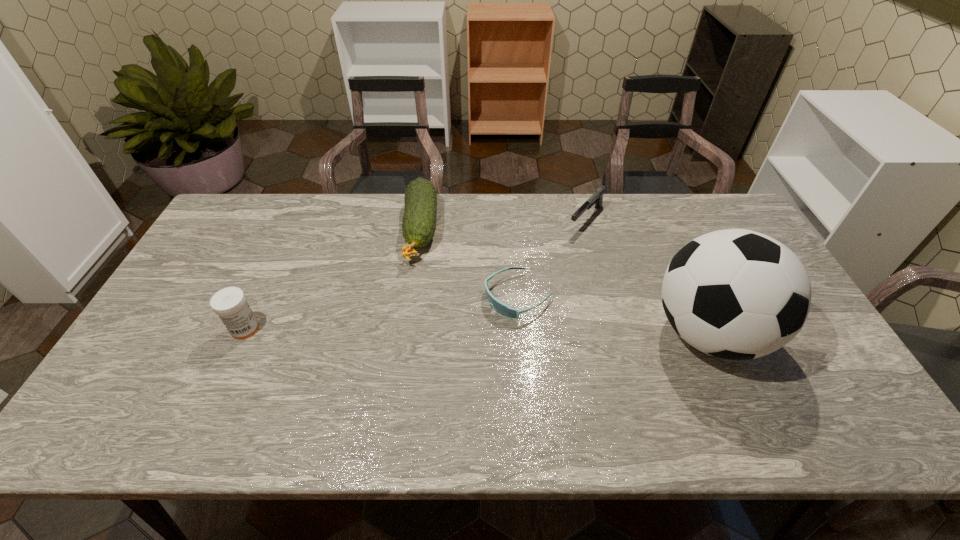
This screenshot has width=960, height=540. What are the coordinates of `free spot located 0.210m on the back of the rightmost object` in the screenshot? It's located at (667, 242).

This screenshot has height=540, width=960. I want to click on vacant space located at the muzzle end of the fourth object from left to right, so click(514, 301).

Locate an element on the screen. vacant point located at the muzzle end of the fourth object from left to right is located at coordinates (565, 244).

Where is `vacant space situated 0.210m at the muzzle end of the fourth object from left to right`? The height and width of the screenshot is (540, 960). vacant space situated 0.210m at the muzzle end of the fourth object from left to right is located at coordinates (543, 269).

Image resolution: width=960 pixels, height=540 pixels. I want to click on vacant area situated on the front-facing side of the third object from right to left, so click(398, 363).

This screenshot has width=960, height=540. Find the location of `blank area located on the front-facing side of the third object from right to left`. blank area located on the front-facing side of the third object from right to left is located at coordinates (366, 382).

What are the coordinates of `vacant space located on the front-facing side of the third object from right to left` in the screenshot? It's located at (398, 363).

This screenshot has width=960, height=540. I want to click on free space located 0.130m at the blossom end of the second object from left to right, so click(x=411, y=302).

Locate an element on the screen. The width and height of the screenshot is (960, 540). vacant space situated 0.340m at the blossom end of the second object from left to right is located at coordinates (403, 366).

At what (x,y) coordinates should I click in order to perform the action: click on blank space located 0.380m at the blossom end of the second object from left to right. Please return your answer as a coordinate pair (x, y). Looking at the image, I should click on (401, 380).